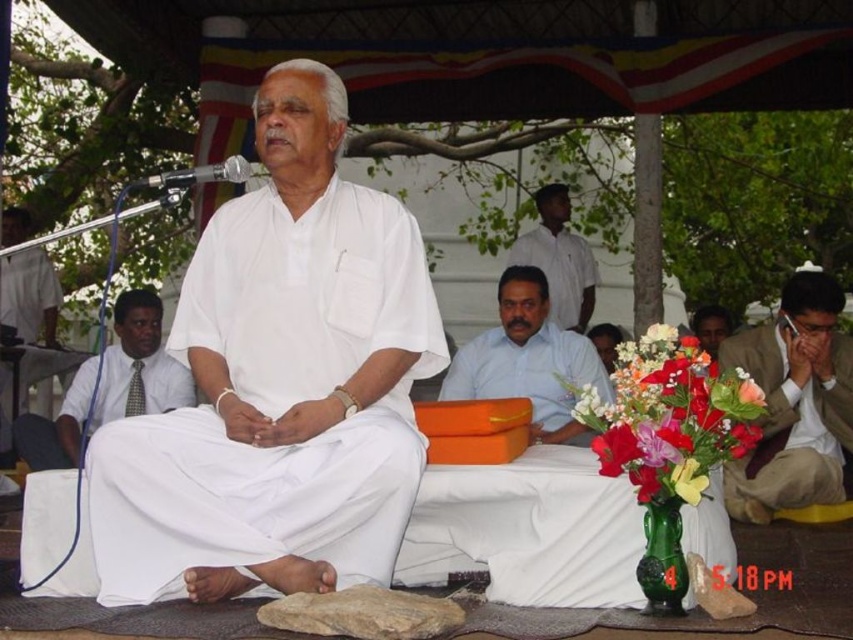
Question: Observing the image, what is the correct spatial positioning of brown textured suit at lower right in reference to white cotton shirt at center?

Choices:
 (A) right
 (B) left

Answer: (B)

Question: In this image, where is white cloth at center located relative to silky floral bouquet at center?

Choices:
 (A) left
 (B) right

Answer: (A)

Question: Which of these objects is positioned closest to the matte white shirt at center?

Choices:
 (A) white cloth at center
 (B) white cotton shirt at left
 (C) white fabric at left

Answer: (A)

Question: Which point is farther to the camera?

Choices:
 (A) brown textured suit at lower right
 (B) matte white shirt at center
 (C) white cotton shirt at center

Answer: (C)

Question: Considering the real-world distances, which object is closest to the silky floral bouquet at center?

Choices:
 (A) matte white shirt at center
 (B) white fabric at left
 (C) white cloth at center
 (D) white cotton shirt at left

Answer: (C)

Question: Does brown textured suit at lower right appear on the right side of white cotton shirt at center?

Choices:
 (A) yes
 (B) no

Answer: (B)